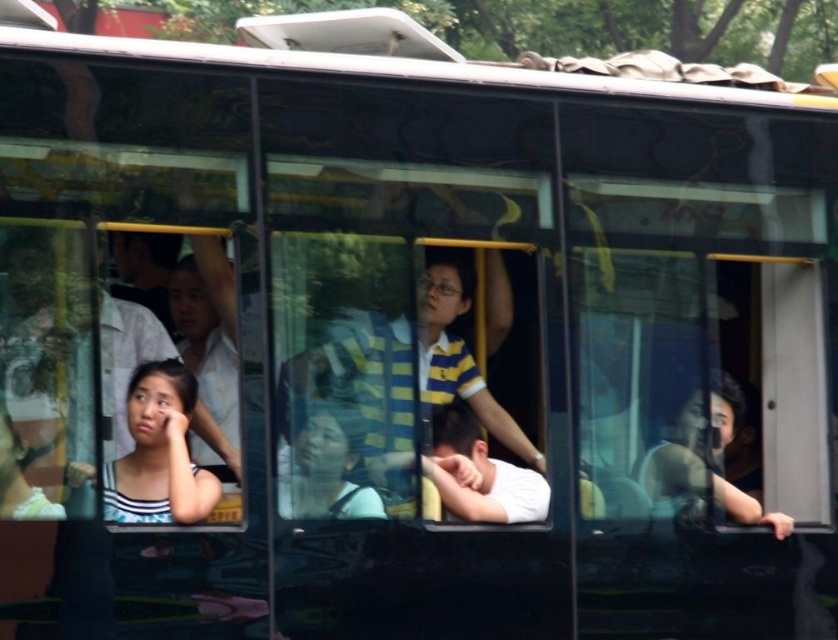
You are a passenger on a bus and want to know how far you are from a specific point marked at coordinates point (459, 512). Can you determine the distance?

The distance between you and point (459, 512) is 5.71 meters.

You are a bus passenger who wants to know if the yellow striped shirt at center is bigger than the striped fabric face at lower left. Can you confirm this?

The yellow striped shirt at center has a larger size compared to striped fabric face at lower left, so yes, the yellow striped shirt at center is bigger than the striped fabric face at lower left.

Looking at this image, you are a bus passenger trying to find an empty seat. You see the yellow striped shirt at center and the striped fabric face at lower left. Which one is closer to the back of the bus?

The striped fabric face at lower left is behind the yellow striped shirt at center, so it is closer to the back of the bus.